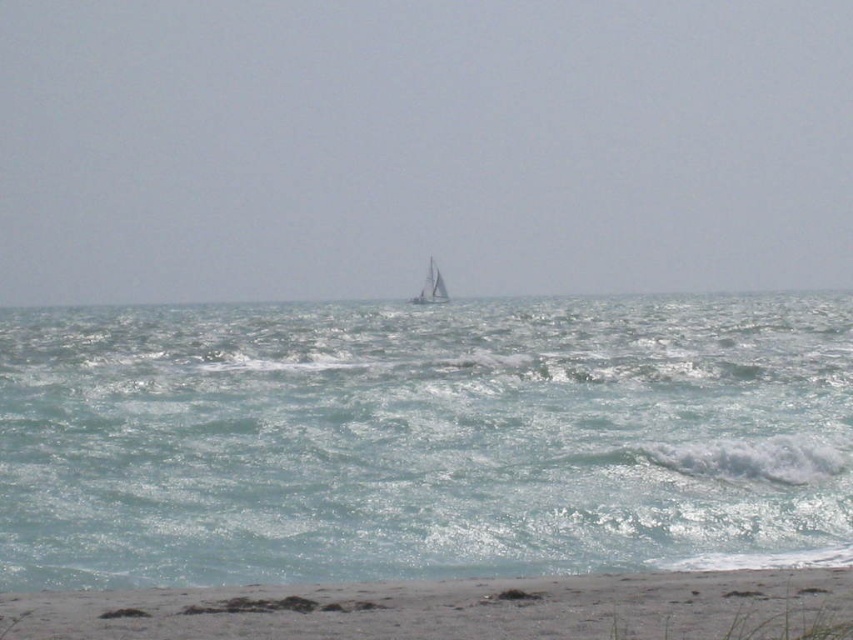
You are a photographer planning to capture a wide shot of the clear blue water at center and the white sailboat at center. Based on the scene, which object should you focus on first if you want to ensure both are in frame?

The clear blue water at center is bigger than the white sailboat at center, so you should focus on the clear blue water at center first to ensure it fits properly in the frame before adjusting for the smaller white sailboat at center.

You are standing on the sandy beach at lower center and want to reach the clear blue water at center. Which direction should you move in to get there?

You should move upward because the clear blue water at center is positioned over sandy beach at lower center.

You are standing on the sandy beach at lower center and want to walk towards the white sailboat at center. Which direction should you face to head directly towards the boat?

You should face to the left because the sandy beach at lower center is positioned on the right side of white sailboat at center, meaning the boat is to your left.